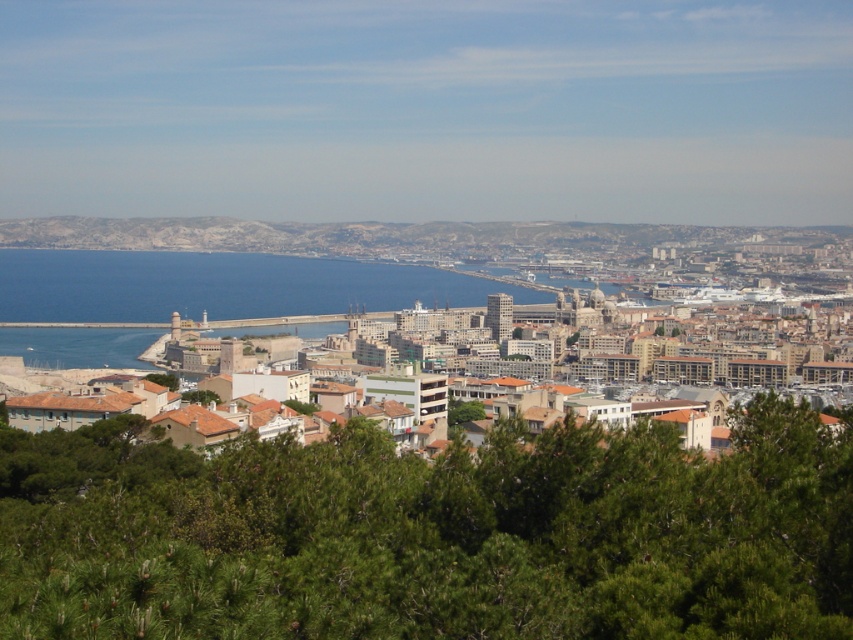
Question: In this image, where is blue water at center located relative to green leafy tree at center?

Choices:
 (A) above
 (B) below

Answer: (A)

Question: Does green leafy tree at lower center appear on the left side of brown stone buildings at center?

Choices:
 (A) no
 (B) yes

Answer: (A)

Question: Among these points, which one is nearest to the camera?

Choices:
 (A) (39, 307)
 (B) (6, 541)
 (C) (451, 413)
 (D) (57, 237)

Answer: (B)

Question: Can you confirm if green leafy tree at lower center is positioned to the right of blue water at center?

Choices:
 (A) yes
 (B) no

Answer: (A)

Question: Which of the following is the closest to the observer?

Choices:
 (A) blue water at center
 (B) brown stone buildings at center
 (C) green leafy tree at lower center

Answer: (C)

Question: Among these objects, which one is farthest from the camera?

Choices:
 (A) green leafy tree at center
 (B) brown stone buildings at center

Answer: (A)